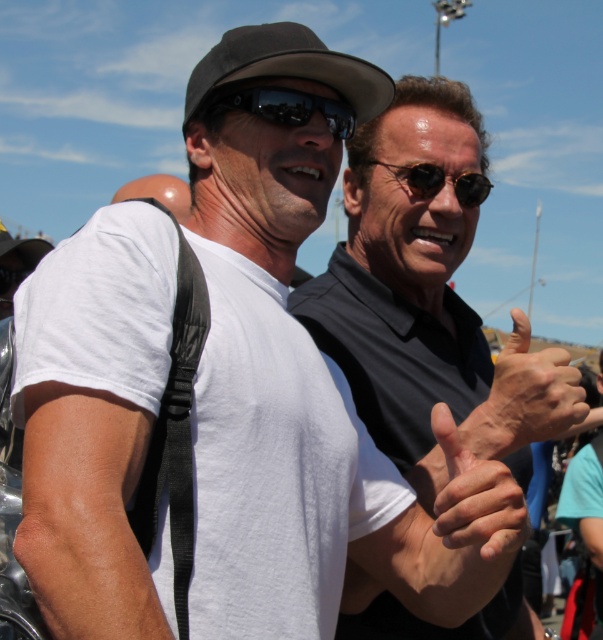
You are a photographer trying to capture the perfect shot of the two people in the scene. You notice the matte black hand at center and the black reflective sunglasses at center. Which object should you position to the left side of your frame to avoid glare from the bright blue sky?

The matte black hand at center is to the right of black reflective sunglasses at center. To avoid glare, position the black reflective sunglasses at center on the left side of the frame since it is already to the left of the matte black hand at center.

You are a photographer trying to capture a closeup shot of the smooth skin hand at center and the black reflective sunglasses at center. Which object should you zoom in on to ensure it fills the frame more without moving the camera?

The smooth skin hand at center might be wider than black reflective sunglasses at center, so you should zoom in on the black reflective sunglasses at center to ensure it fills the frame more without moving the camera.